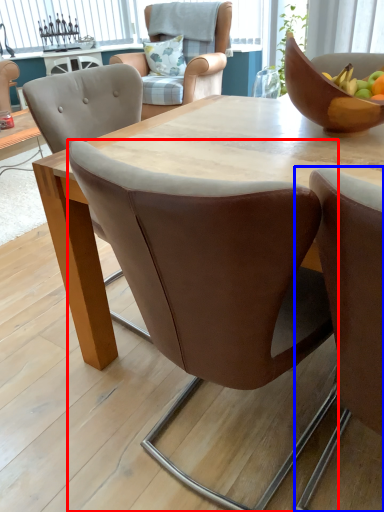
Question: Which of the following is the closest to the observer, chair (highlighted by a red box) or chair (highlighted by a blue box)?

Choices:
 (A) chair
 (B) chair

Answer: (B)